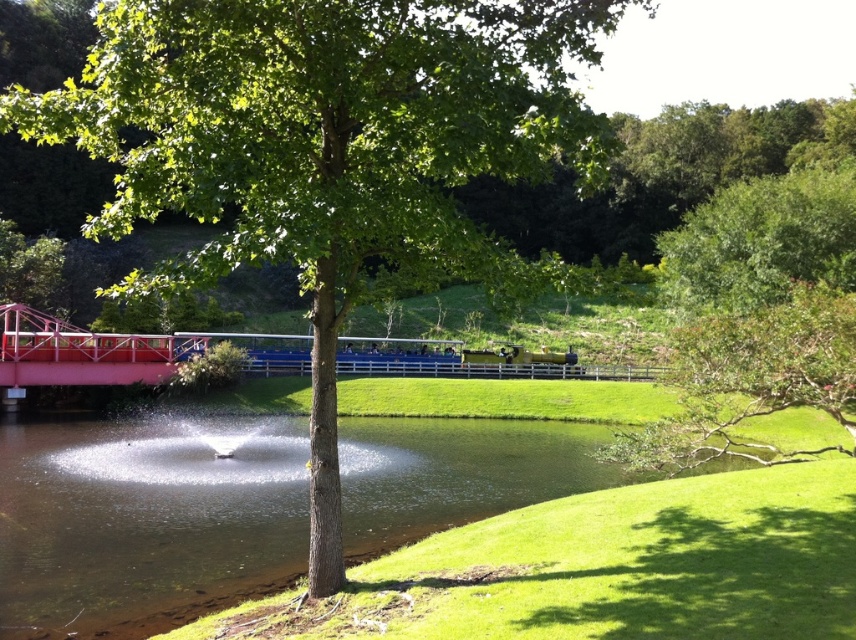
Question: Which point is farther from the camera taking this photo?

Choices:
 (A) (801, 394)
 (B) (129, 100)

Answer: (A)

Question: Is green leafy tree at center wider than green leafy tree at upper right?

Choices:
 (A) no
 (B) yes

Answer: (B)

Question: Can you confirm if green leafy tree at center is positioned above green leafy tree at upper right?

Choices:
 (A) yes
 (B) no

Answer: (A)

Question: Is green leafy tree at center positioned in front of green leafy tree at upper right?

Choices:
 (A) no
 (B) yes

Answer: (B)

Question: Which object is farther from the camera taking this photo?

Choices:
 (A) green leafy tree at upper right
 (B) green leafy tree at center

Answer: (A)

Question: Which point is farther to the camera?

Choices:
 (A) (704, 458)
 (B) (366, 193)

Answer: (A)